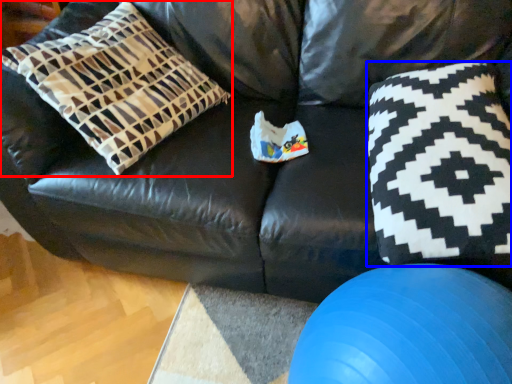
Question: Which point is closer to the camera, pillow (highlighted by a red box) or throw pillow (highlighted by a blue box)?

Choices:
 (A) pillow
 (B) throw pillow

Answer: (B)